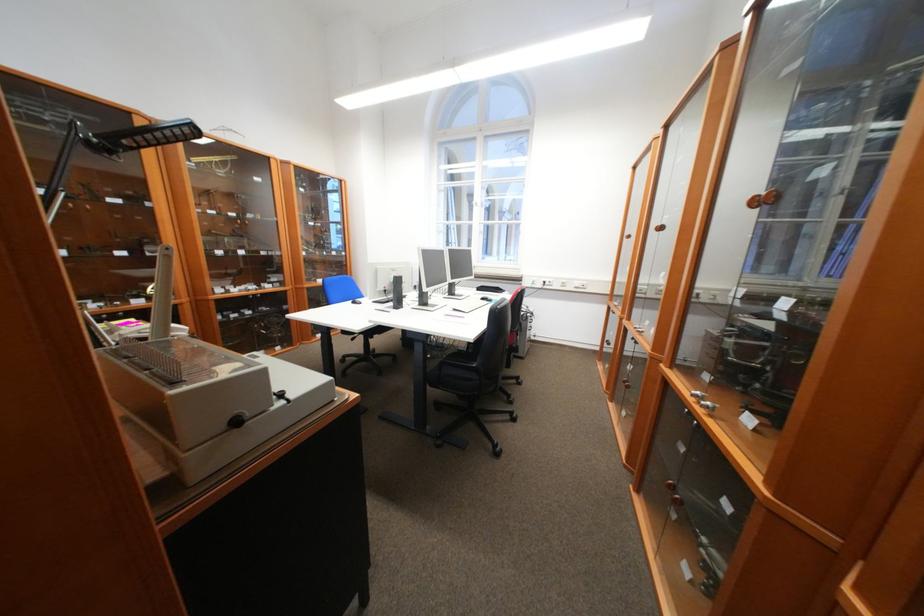
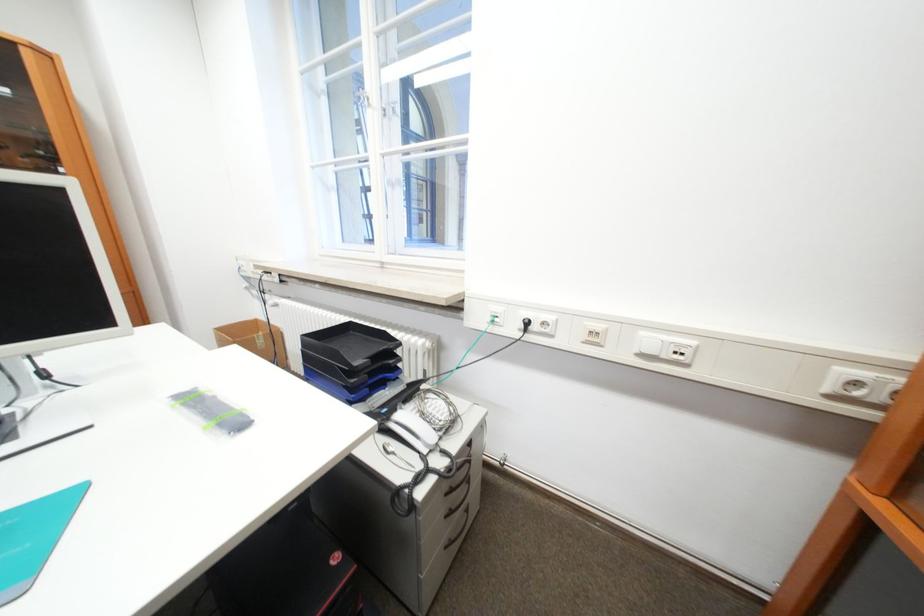
In a continuous first-person perspective shot, in which direction is the camera moving?

The cameraman moved toward right, forward.